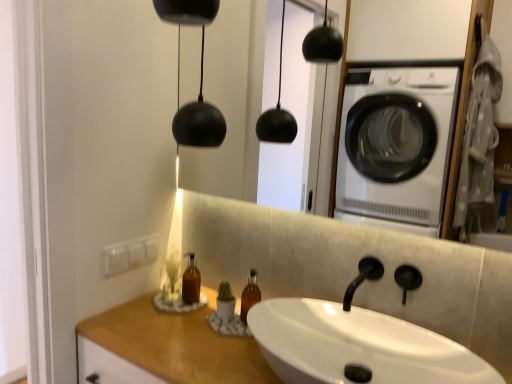
Question: Should I look upward or downward to see wooden counter top at lower left?

Choices:
 (A) up
 (B) down

Answer: (B)

Question: Is the position of wooden counter top at lower left more distant than that of white glossy sink at center?

Choices:
 (A) yes
 (B) no

Answer: (A)

Question: Does wooden counter top at lower left have a smaller size compared to white glossy sink at center?

Choices:
 (A) no
 (B) yes

Answer: (A)

Question: Considering the relative sizes of wooden counter top at lower left and white glossy sink at center in the image provided, is wooden counter top at lower left shorter than white glossy sink at center?

Choices:
 (A) no
 (B) yes

Answer: (A)

Question: Does wooden counter top at lower left have a greater width compared to white glossy sink at center?

Choices:
 (A) no
 (B) yes

Answer: (B)

Question: Is wooden counter top at lower left in contact with white glossy sink at center?

Choices:
 (A) no
 (B) yes

Answer: (A)

Question: Is wooden counter top at lower left bigger than white glossy sink at center?

Choices:
 (A) yes
 (B) no

Answer: (A)

Question: Does white glossy sink at center have a lesser width compared to black matte faucet at center?

Choices:
 (A) no
 (B) yes

Answer: (A)

Question: Is white glossy sink at center located outside black matte faucet at center?

Choices:
 (A) yes
 (B) no

Answer: (A)

Question: Considering the relative sizes of white glossy sink at center and black matte faucet at center in the image provided, is white glossy sink at center taller than black matte faucet at center?

Choices:
 (A) yes
 (B) no

Answer: (A)

Question: From the image's perspective, is white glossy sink at center on black matte faucet at center?

Choices:
 (A) no
 (B) yes

Answer: (A)

Question: Is the position of white glossy sink at center more distant than that of black matte faucet at center?

Choices:
 (A) yes
 (B) no

Answer: (B)

Question: From a real-world perspective, does white glossy sink at center sit lower than black matte faucet at center?

Choices:
 (A) no
 (B) yes

Answer: (B)

Question: Is black matte faucet at center oriented towards wooden counter top at lower left?

Choices:
 (A) yes
 (B) no

Answer: (B)